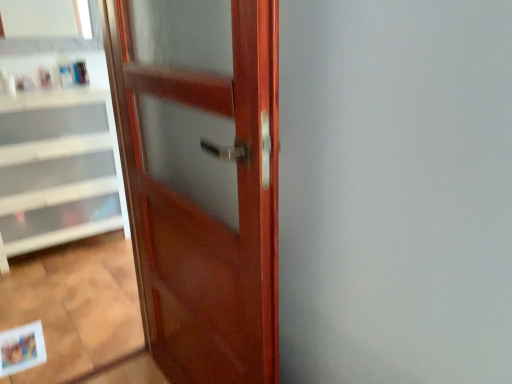
Question: Does matte plastic bottle at upper left, the first toiletry viewed from the right, turn towards translucent plastic bottle at upper left, the 2th toiletry in the right-to-left sequence?

Choices:
 (A) no
 (B) yes

Answer: (A)

Question: Is matte plastic bottle at upper left, positioned as the third toiletry in left-to-right order, behind translucent plastic bottle at upper left, which ranks as the second toiletry in left-to-right order?

Choices:
 (A) yes
 (B) no

Answer: (A)

Question: Is matte plastic bottle at upper left, positioned as the third toiletry in left-to-right order, in front of translucent plastic bottle at upper left, which ranks as the second toiletry in left-to-right order?

Choices:
 (A) yes
 (B) no

Answer: (B)

Question: Is matte plastic bottle at upper left, positioned as the third toiletry in left-to-right order, thinner than translucent plastic bottle at upper left, which ranks as the second toiletry in left-to-right order?

Choices:
 (A) no
 (B) yes

Answer: (B)

Question: Is matte plastic bottle at upper left, positioned as the third toiletry in left-to-right order, wider than translucent plastic bottle at upper left, the 2th toiletry in the right-to-left sequence?

Choices:
 (A) yes
 (B) no

Answer: (B)

Question: From a real-world perspective, is matte plastic bottle at upper left, the first toiletry viewed from the right, above or below matte paper postcard at lower left?

Choices:
 (A) below
 (B) above

Answer: (B)

Question: Would you say matte plastic bottle at upper left, positioned as the third toiletry in left-to-right order, is to the left or to the right of matte paper postcard at lower left in the picture?

Choices:
 (A) left
 (B) right

Answer: (A)

Question: Is matte plastic bottle at upper left, the first toiletry viewed from the right, wider or thinner than matte paper postcard at lower left?

Choices:
 (A) thin
 (B) wide

Answer: (A)

Question: From the image's perspective, is matte plastic bottle at upper left, the first toiletry viewed from the right, located above or below matte paper postcard at lower left?

Choices:
 (A) below
 (B) above

Answer: (B)

Question: From a real-world perspective, is matte plastic bottle at upper left, the first toiletry viewed from the right, positioned above or below glossy wood door at center?

Choices:
 (A) below
 (B) above

Answer: (B)

Question: Is matte plastic bottle at upper left, the first toiletry viewed from the right, situated inside glossy wood door at center or outside?

Choices:
 (A) outside
 (B) inside

Answer: (A)

Question: Is matte plastic bottle at upper left, positioned as the third toiletry in left-to-right order, to the left or to the right of glossy wood door at center in the image?

Choices:
 (A) right
 (B) left

Answer: (B)

Question: Considering the positions of matte plastic bottle at upper left, the first toiletry viewed from the right, and glossy wood door at center in the image, is matte plastic bottle at upper left, the first toiletry viewed from the right, wider or thinner than glossy wood door at center?

Choices:
 (A) thin
 (B) wide

Answer: (A)

Question: Would you say glossy wood door at center is to the left or to the right of white glossy cabinet at left in the picture?

Choices:
 (A) right
 (B) left

Answer: (A)

Question: Considering the positions of glossy wood door at center and white glossy cabinet at left in the image, is glossy wood door at center bigger or smaller than white glossy cabinet at left?

Choices:
 (A) big
 (B) small

Answer: (B)